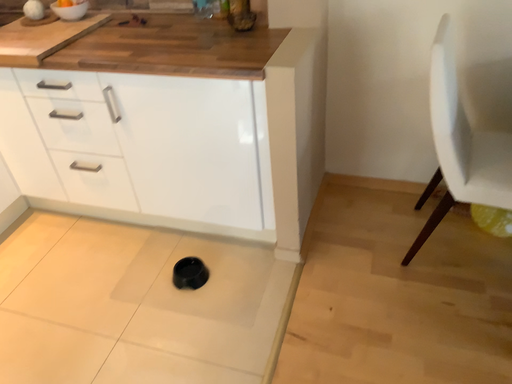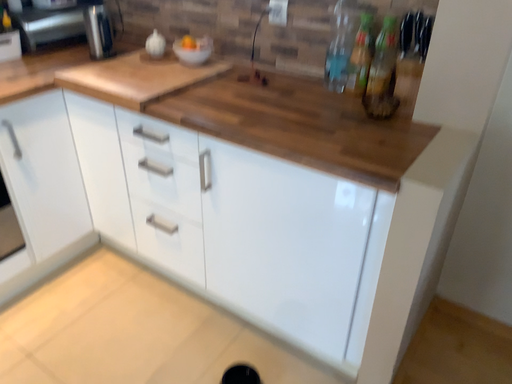
Question: How did the camera likely rotate when shooting the video?

Choices:
 (A) rotated right
 (B) rotated left

Answer: (B)